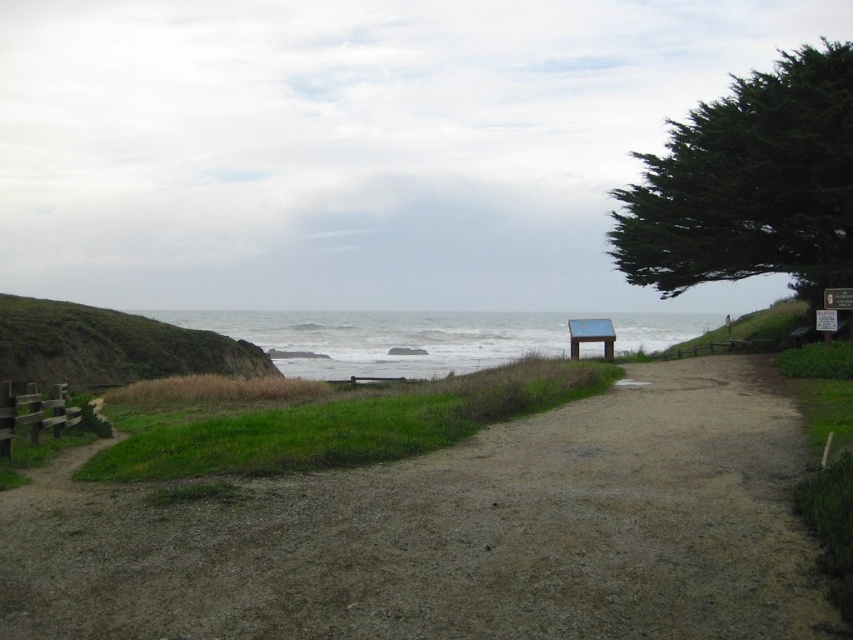
You are planning to walk along the dirt path at center and want to know if there is enough space to pass by the green leafy tree at upper right. Based on the scene description, can you determine if the path is wide enough?

The dirt path at center occupies less space than the green leafy tree at upper right, which means the tree takes up more area in the image. However, the path is designed for walking, so it should still be wide enough to pass by the tree unless the tree physically blocks the path. Since the description doesn

You are standing at the point marked by the coordinates point (456, 534). What object is located exactly at that point?

The dirt path at center is located exactly at point (456, 534).